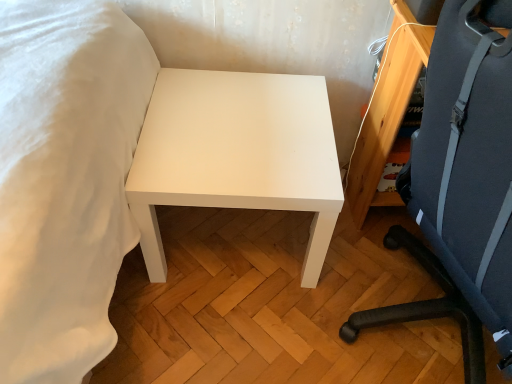
The image size is (512, 384). I want to click on white matte table at center, so click(236, 154).

Describe the element at coordinates (236, 154) in the screenshot. This screenshot has width=512, height=384. I see `white matte table at center` at that location.

The height and width of the screenshot is (384, 512). I want to click on dark blue fabric chair at right, so click(462, 185).

What do you see at coordinates (462, 185) in the screenshot? I see `dark blue fabric chair at right` at bounding box center [462, 185].

Locate an element on the screen. white matte table at center is located at coordinates click(x=236, y=154).

Considering the relative positions of white matte table at center and dark blue fabric chair at right in the image provided, is white matte table at center to the right of dark blue fabric chair at right from the viewer's perspective?

No.

Considering their positions, is white matte table at center located in front of or behind dark blue fabric chair at right?

Visually, white matte table at center is located behind dark blue fabric chair at right.

Considering the positions of points (287, 133) and (497, 205), is point (287, 133) farther from camera compared to point (497, 205)?

That is True.

From the image's perspective, is white matte table at center on dark blue fabric chair at right?

Yes.

From a real-world perspective, is white matte table at center above or below dark blue fabric chair at right?

Clearly, from a real-world perspective, white matte table at center is below dark blue fabric chair at right.

Considering the sizes of white matte table at center and dark blue fabric chair at right in the image, is white matte table at center wider or thinner than dark blue fabric chair at right?

Considering their sizes, white matte table at center looks slimmer than dark blue fabric chair at right.

Between white matte table at center and dark blue fabric chair at right, which one has more height?

With more height is dark blue fabric chair at right.

Between white matte table at center and dark blue fabric chair at right, which one has larger size?

dark blue fabric chair at right is bigger.

Would you say dark blue fabric chair at right is part of white matte table at center's contents?

No.

Is white matte table at center positioned far away from dark blue fabric chair at right?

No, white matte table at center is in close proximity to dark blue fabric chair at right.

Could you tell me if white matte table at center is turned towards dark blue fabric chair at right?

No, white matte table at center does not turn towards dark blue fabric chair at right.

What's the angular difference between white matte table at center and dark blue fabric chair at right's facing directions?

There is a 89.3-degree angle between the facing directions of white matte table at center and dark blue fabric chair at right.

The height and width of the screenshot is (384, 512). I want to click on table that appears above the dark blue fabric chair at right (from the image's perspective), so click(x=236, y=154).

Does dark blue fabric chair at right appear on the left side of white matte table at center?

Incorrect, dark blue fabric chair at right is not on the left side of white matte table at center.

Which object is further away from the camera, dark blue fabric chair at right or white matte table at center?

white matte table at center is further from the camera.

Which is less distant, (506, 161) or (333, 205)?

Clearly, point (506, 161) is closer to the camera than point (333, 205).

In the scene shown: From the image's perspective, between dark blue fabric chair at right and white matte table at center, who is located below?

dark blue fabric chair at right appears lower in the image.

Based on the photo, from a real-world perspective, which object stands above the other?

From a 3D spatial view, dark blue fabric chair at right is above.

Considering the relative sizes of dark blue fabric chair at right and white matte table at center in the image provided, is dark blue fabric chair at right thinner than white matte table at center?

In fact, dark blue fabric chair at right might be wider than white matte table at center.

Considering the relative sizes of dark blue fabric chair at right and white matte table at center in the image provided, is dark blue fabric chair at right shorter than white matte table at center?

In fact, dark blue fabric chair at right may be taller than white matte table at center.

Considering the sizes of objects dark blue fabric chair at right and white matte table at center in the image provided, who is bigger, dark blue fabric chair at right or white matte table at center?

dark blue fabric chair at right.

From the picture: Can white matte table at center be found inside dark blue fabric chair at right?

Definitely not — white matte table at center is not inside dark blue fabric chair at right.

Looking at this image, is there a large distance between dark blue fabric chair at right and white matte table at center?

That's not correct — dark blue fabric chair at right is a little close to white matte table at center.

Is dark blue fabric chair at right facing towards white matte table at center?

Yes, dark blue fabric chair at right is aimed at white matte table at center.

What's the angular difference between dark blue fabric chair at right and white matte table at center's facing directions?

The facing directions of dark blue fabric chair at right and white matte table at center are 89.3 degrees apart.

Locate an element on the screen. table on the left side of dark blue fabric chair at right is located at coordinates (236, 154).

The image size is (512, 384). What are the coordinates of `chair on the right of the white matte table at center` in the screenshot? It's located at (462, 185).

The width and height of the screenshot is (512, 384). Find the location of `chair in front of the white matte table at center`. chair in front of the white matte table at center is located at coordinates (462, 185).